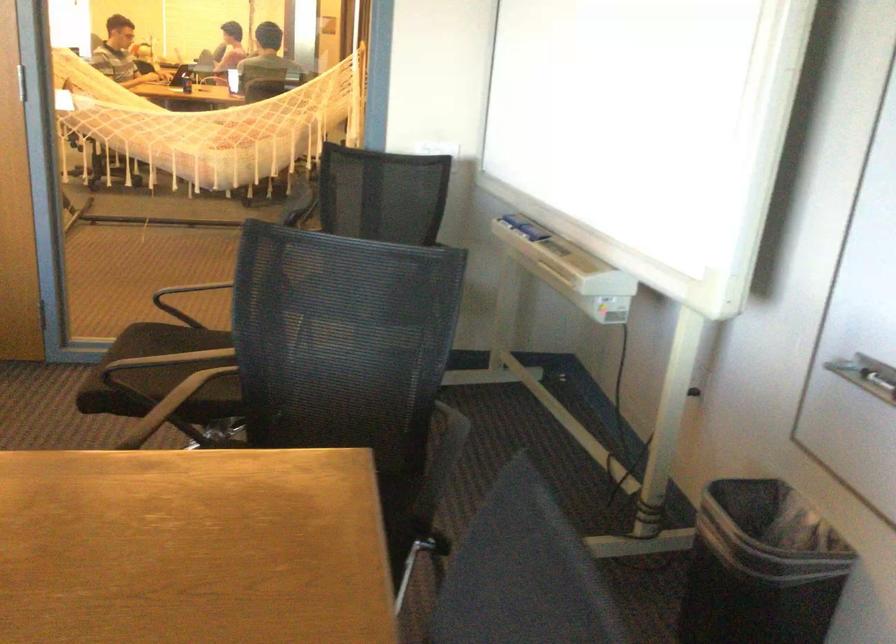
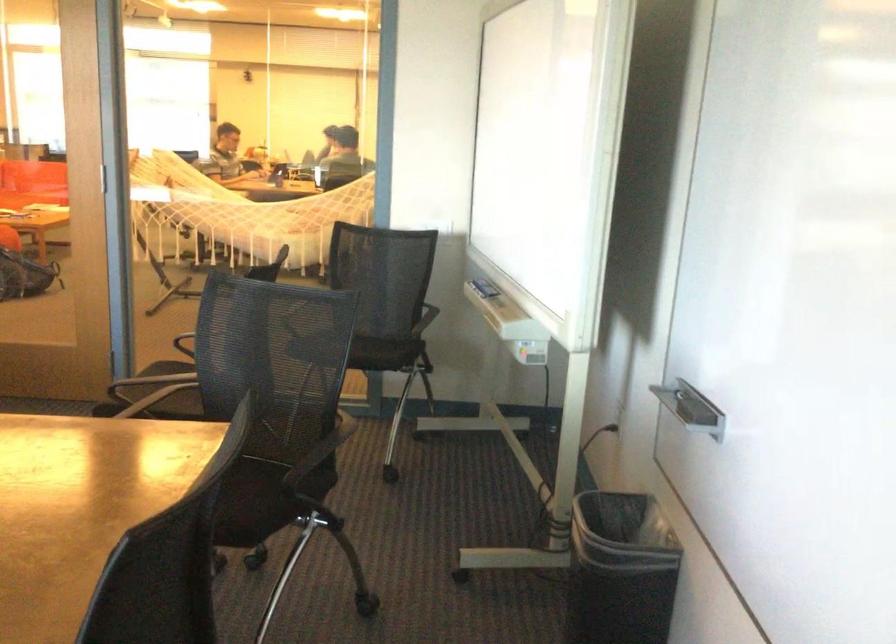
Find the pixel in the second image that matches pixel 176 129 in the first image.

(246, 213)